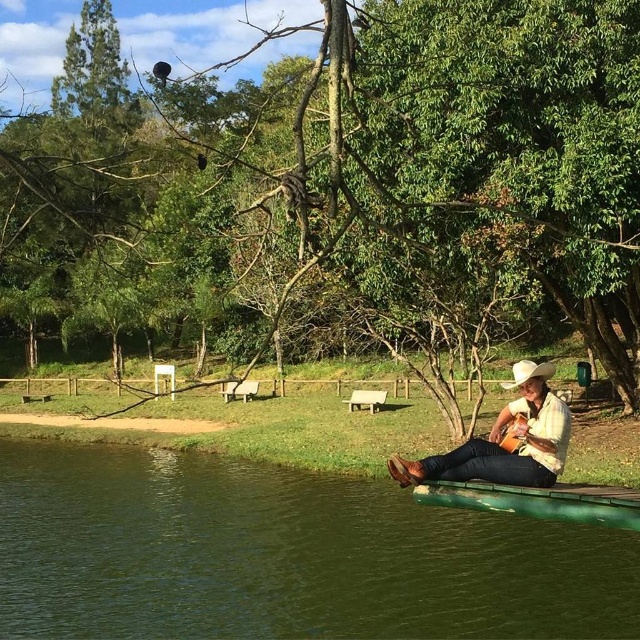
Can you confirm if leather cowboy hat at center is positioned to the left of green rubber canoe at lower center?

No, leather cowboy hat at center is not to the left of green rubber canoe at lower center.

Is point (436, 454) in front of point (570, 515)?

No.

Describe the element at coordinates (508, 436) in the screenshot. The image size is (640, 640). I see `leather cowboy hat at center` at that location.

Identify the location of leather cowboy hat at center. (508, 436).

Does green rubber raft at lower right appear under leather cowboy hat at center?

Yes, green rubber raft at lower right is below leather cowboy hat at center.

Can you confirm if green rubber raft at lower right is bigger than leather cowboy hat at center?

Yes, green rubber raft at lower right is bigger than leather cowboy hat at center.

Is point (74, 552) positioned in front of point (500, 432)?

No, (74, 552) is further to viewer.

Identify the location of green rubber raft at lower right. The width and height of the screenshot is (640, 640). (284, 556).

Is green rubber raft at lower right shorter than green rubber canoe at lower center?

Incorrect, green rubber raft at lower right's height does not fall short of green rubber canoe at lower center's.

Does point (92, 451) lie in front of point (572, 504)?

No, (92, 451) is behind (572, 504).

Find the location of a particular element. green rubber raft at lower right is located at coordinates (284, 556).